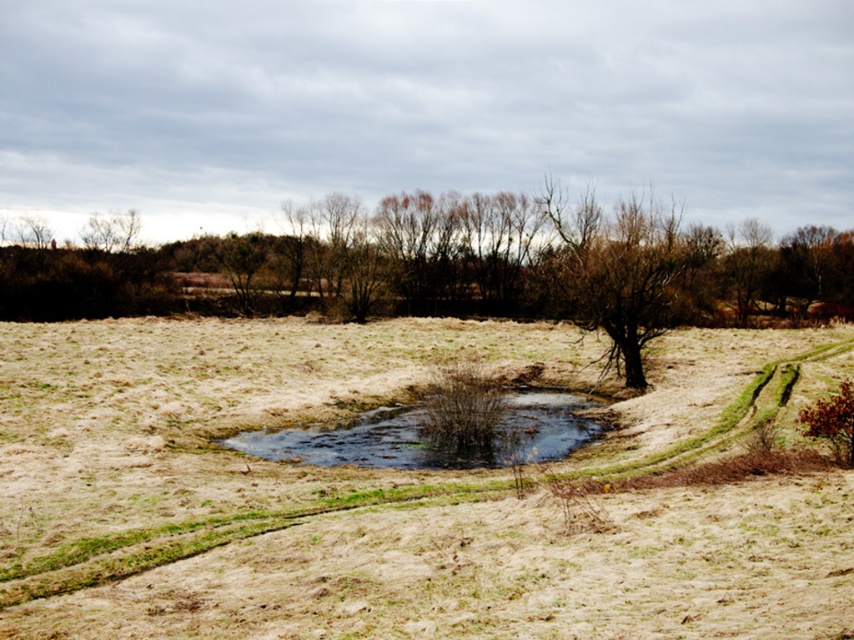
Can you confirm if brown grassy field at center is shorter than brown/dry wood tree at center?

Yes.

Does brown grassy field at center lie in front of brown/dry wood tree at center?

Yes.

Identify the location of brown grassy field at center. pyautogui.click(x=357, y=500).

Can you confirm if brown grassy field at center is positioned to the right of dark green water at center?

Indeed, brown grassy field at center is positioned on the right side of dark green water at center.

Locate an element on the screen. This screenshot has width=854, height=640. brown grassy field at center is located at coordinates (357, 500).

Who is higher up, brown/dry wood tree at center or dark green water at center?

brown/dry wood tree at center is above.

Is point (667, 301) farther from viewer compared to point (502, 435)?

Yes, it is.

Where is `brown/dry wood tree at center`? brown/dry wood tree at center is located at coordinates (613, 273).